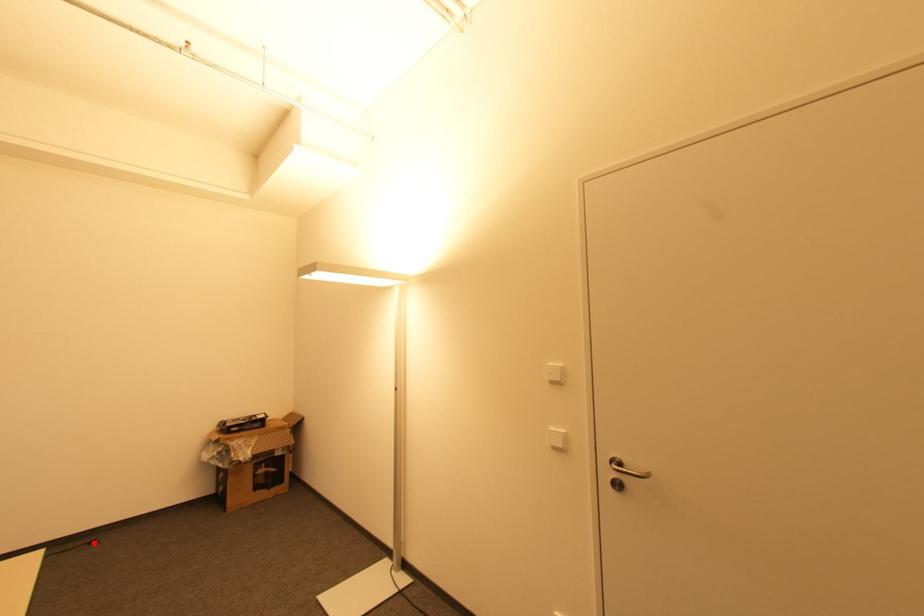
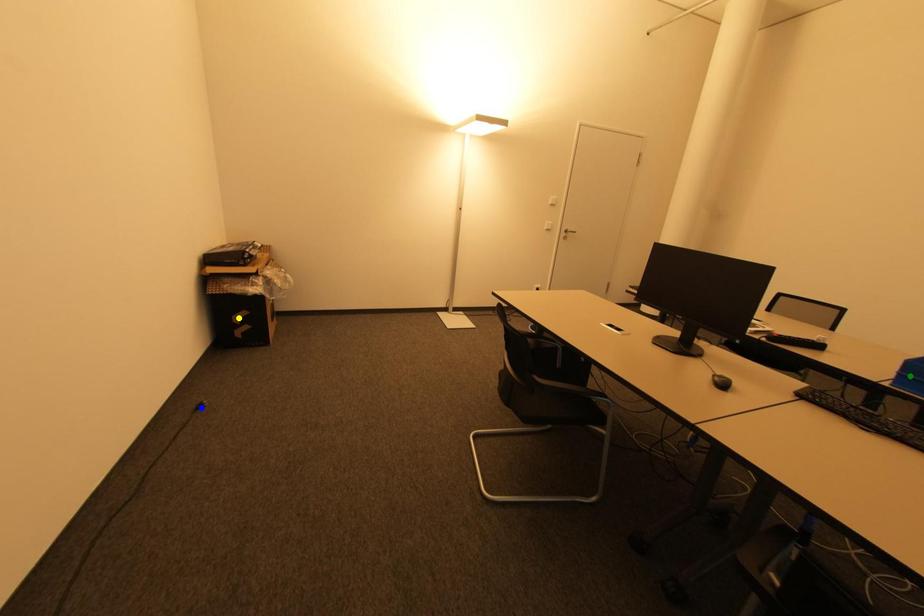
Question: I am providing you with two images of the same scene from different viewpoints. A red point is marked on the first image. You are given multiple points on the second image. In image 2, which mark is for the same physical point as the one in image 1?

Choices:
 (A) blue point
 (B) yellow point
 (C) green point

Answer: (A)